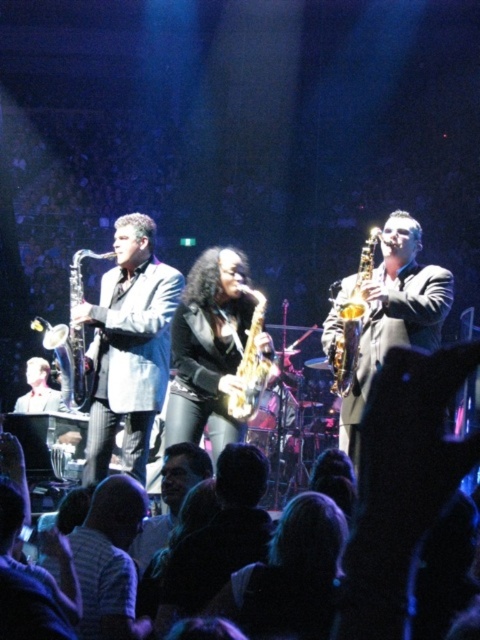
Question: Among these objects, which one is farthest from the camera?

Choices:
 (A) gold metallic saxophone at center
 (B) shiny gold saxophone at left

Answer: (A)

Question: Is matte gray suit at left bigger than gold metallic saxophone at center?

Choices:
 (A) yes
 (B) no

Answer: (A)

Question: Which point appears closest to the camera in this image?

Choices:
 (A) (352, 298)
 (B) (259, 364)
 (C) (84, 339)

Answer: (A)

Question: Which is nearer to the gold metallic saxophone at center?

Choices:
 (A) matte gray suit at left
 (B) gold lacquered saxophone at center

Answer: (B)

Question: Can you confirm if matte gray suit at left is positioned above gold shiny saxophone at right?

Choices:
 (A) no
 (B) yes

Answer: (A)

Question: Is matte gray suit at left smaller than shiny gold saxophone at left?

Choices:
 (A) yes
 (B) no

Answer: (B)